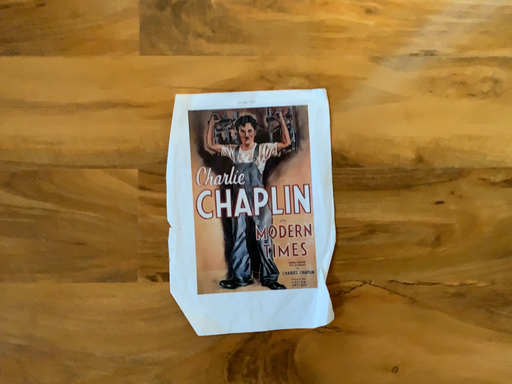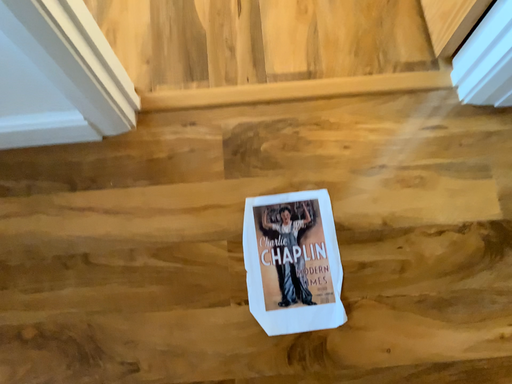
Question: Which way did the camera rotate in the video?

Choices:
 (A) rotated upward
 (B) rotated downward

Answer: (A)